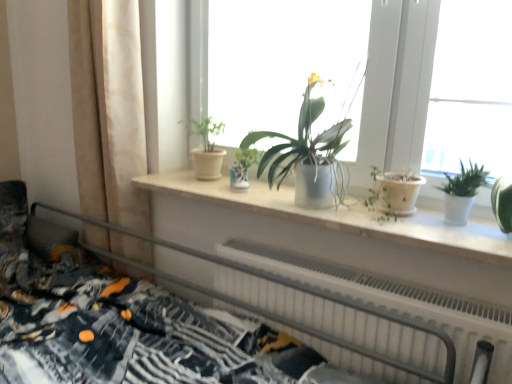
The height and width of the screenshot is (384, 512). In order to click on free area below matte silver pot at center, which is the second houseplant in right-to-left order (from a real-world perspective) in this screenshot , I will do `click(289, 199)`.